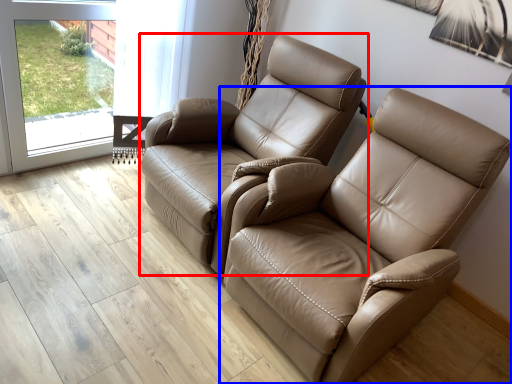
Question: Which of the following is the closest to the observer, chair (highlighted by a red box) or chair (highlighted by a blue box)?

Choices:
 (A) chair
 (B) chair

Answer: (B)